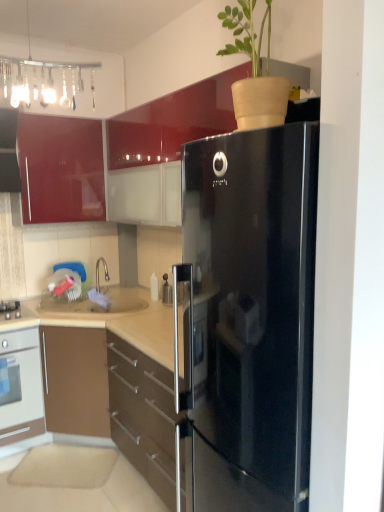
What do you see at coordinates (60, 169) in the screenshot? The height and width of the screenshot is (512, 384). I see `glossy red cabinet at upper left, which is counted as the first cabinetry, starting from the top` at bounding box center [60, 169].

The height and width of the screenshot is (512, 384). I want to click on brown glossy cabinet at lower left, arranged as the second cabinetry when viewed from the top, so click(97, 383).

Is glossy red cabinet at upper left, arranged as the second cabinetry when ordered from the bottom, inside or outside of white glossy oven at lower left?

glossy red cabinet at upper left, arranged as the second cabinetry when ordered from the bottom, cannot be found inside white glossy oven at lower left.

Which object is positioned more to the right, glossy red cabinet at upper left, arranged as the second cabinetry when ordered from the bottom, or white glossy oven at lower left?

glossy red cabinet at upper left, arranged as the second cabinetry when ordered from the bottom, is more to the right.

Is glossy red cabinet at upper left, arranged as the second cabinetry when ordered from the bottom, facing towards white glossy oven at lower left?

No, glossy red cabinet at upper left, arranged as the second cabinetry when ordered from the bottom, is not aimed at white glossy oven at lower left.

Which object is closer to the camera taking this photo, glossy red cabinet at upper left, arranged as the second cabinetry when ordered from the bottom, or white glossy oven at lower left?

white glossy oven at lower left.

Consider the image. In terms of width, does white glossy oven at lower left look wider or thinner when compared to glossy red cabinet at upper left, arranged as the second cabinetry when ordered from the bottom?

Considering their sizes, white glossy oven at lower left looks broader than glossy red cabinet at upper left, arranged as the second cabinetry when ordered from the bottom.

Where is `oven in front of the glossy red cabinet at upper left, arranged as the second cabinetry when ordered from the bottom`? The image size is (384, 512). oven in front of the glossy red cabinet at upper left, arranged as the second cabinetry when ordered from the bottom is located at coordinates (20, 386).

Considering the relative sizes of glossy red cabinet at upper left, arranged as the second cabinetry when ordered from the bottom, and brown glossy cabinet at lower left, the first cabinetry positioned from the bottom, in the image provided, is glossy red cabinet at upper left, arranged as the second cabinetry when ordered from the bottom, bigger than brown glossy cabinet at lower left, the first cabinetry positioned from the bottom,?

No, glossy red cabinet at upper left, arranged as the second cabinetry when ordered from the bottom, is not bigger than brown glossy cabinet at lower left, the first cabinetry positioned from the bottom.

Consider the image. Between glossy red cabinet at upper left, arranged as the second cabinetry when ordered from the bottom, and brown glossy cabinet at lower left, the first cabinetry positioned from the bottom, which one has larger width?

brown glossy cabinet at lower left, the first cabinetry positioned from the bottom.

Between glossy red cabinet at upper left, which is counted as the first cabinetry, starting from the top, and brown glossy cabinet at lower left, the first cabinetry positioned from the bottom, which one has less height?

glossy red cabinet at upper left, which is counted as the first cabinetry, starting from the top.

In the scene shown: Can brown glossy cabinet at lower left, the first cabinetry positioned from the bottom, be found inside glossy red cabinet at upper left, which is counted as the first cabinetry, starting from the top?

No, brown glossy cabinet at lower left, the first cabinetry positioned from the bottom, is not inside glossy red cabinet at upper left, which is counted as the first cabinetry, starting from the top.

From the image's perspective, who appears lower, white glossy oven at lower left or brown glossy cabinet at lower left, the first cabinetry positioned from the bottom?

brown glossy cabinet at lower left, the first cabinetry positioned from the bottom.

From a real-world perspective, relative to brown glossy cabinet at lower left, the first cabinetry positioned from the bottom, is white glossy oven at lower left vertically above or below?

In terms of real-world spatial position, white glossy oven at lower left is above brown glossy cabinet at lower left, the first cabinetry positioned from the bottom.

In the scene shown: Considering the relative positions of white glossy oven at lower left and brown glossy cabinet at lower left, the first cabinetry positioned from the bottom, in the image provided, is white glossy oven at lower left to the left of brown glossy cabinet at lower left, the first cabinetry positioned from the bottom, from the viewer's perspective?

Yes.

The height and width of the screenshot is (512, 384). In order to click on oven that appears above the brown glossy cabinet at lower left, arranged as the second cabinetry when viewed from the top (from a real-world perspective) in this screenshot , I will do `click(20, 386)`.

Which object is closer to the camera, brown glossy cabinet at lower left, the first cabinetry positioned from the bottom, or white glossy oven at lower left?

brown glossy cabinet at lower left, the first cabinetry positioned from the bottom.

From a real-world perspective, is brown glossy cabinet at lower left, arranged as the second cabinetry when viewed from the top, physically below white glossy oven at lower left?

Yes.

Is brown glossy cabinet at lower left, the first cabinetry positioned from the bottom, facing towards white glossy oven at lower left?

Yes, brown glossy cabinet at lower left, the first cabinetry positioned from the bottom, is turned towards white glossy oven at lower left.

Considering the positions of point (47, 481) and point (10, 337), is point (47, 481) closer or farther from the camera than point (10, 337)?

Clearly, point (47, 481) is closer to the camera than point (10, 337).

Is brown glossy cabinet at lower left, arranged as the second cabinetry when viewed from the top, oriented away from glossy red cabinet at upper left, arranged as the second cabinetry when ordered from the bottom?

No, brown glossy cabinet at lower left, arranged as the second cabinetry when viewed from the top, is not facing away from glossy red cabinet at upper left, arranged as the second cabinetry when ordered from the bottom.

Is brown glossy cabinet at lower left, the first cabinetry positioned from the bottom, wider than glossy red cabinet at upper left, which is counted as the first cabinetry, starting from the top?

Yes.

Is point (16, 417) behind point (101, 205)?

No.

From a real-world perspective, which is physically above, brown glossy cabinet at lower left, the first cabinetry positioned from the bottom, or glossy red cabinet at upper left, arranged as the second cabinetry when ordered from the bottom?

From a 3D spatial view, glossy red cabinet at upper left, arranged as the second cabinetry when ordered from the bottom, is above.

Where is `cabinetry behind the white glossy oven at lower left`? The image size is (384, 512). cabinetry behind the white glossy oven at lower left is located at coordinates (60, 169).

This screenshot has height=512, width=384. I want to click on the 1st cabinetry to the right of the white glossy oven at lower left, starting your count from the anchor, so click(x=60, y=169).

From the image, which object appears to be nearer to brown glossy cabinet at lower left, arranged as the second cabinetry when viewed from the top, glossy red cabinet at upper left, arranged as the second cabinetry when ordered from the bottom, or white glossy oven at lower left?

white glossy oven at lower left lies closer to brown glossy cabinet at lower left, arranged as the second cabinetry when viewed from the top, than the other object.

Considering their positions, is brown glossy cabinet at lower left, arranged as the second cabinetry when viewed from the top, positioned further to glossy red cabinet at upper left, arranged as the second cabinetry when ordered from the bottom, than white glossy oven at lower left?

Among the two, brown glossy cabinet at lower left, arranged as the second cabinetry when viewed from the top, is located further to glossy red cabinet at upper left, arranged as the second cabinetry when ordered from the bottom.

When comparing their distances from brown glossy cabinet at lower left, arranged as the second cabinetry when viewed from the top, does white glossy oven at lower left or glossy red cabinet at upper left, which is counted as the first cabinetry, starting from the top, seem further?

glossy red cabinet at upper left, which is counted as the first cabinetry, starting from the top, lies further to brown glossy cabinet at lower left, arranged as the second cabinetry when viewed from the top, than the other object.

From the image, which object appears to be farther from white glossy oven at lower left, brown glossy cabinet at lower left, the first cabinetry positioned from the bottom, or glossy red cabinet at upper left, arranged as the second cabinetry when ordered from the bottom?

glossy red cabinet at upper left, arranged as the second cabinetry when ordered from the bottom, lies further to white glossy oven at lower left than the other object.

Considering their positions, is white glossy oven at lower left positioned closer to glossy red cabinet at upper left, arranged as the second cabinetry when ordered from the bottom, than brown glossy cabinet at lower left, arranged as the second cabinetry when viewed from the top?

Based on the image, white glossy oven at lower left appears to be nearer to glossy red cabinet at upper left, arranged as the second cabinetry when ordered from the bottom.

Which object lies nearer to the anchor point white glossy oven at lower left, glossy red cabinet at upper left, arranged as the second cabinetry when ordered from the bottom, or brown glossy cabinet at lower left, the first cabinetry positioned from the bottom?

The object closer to white glossy oven at lower left is brown glossy cabinet at lower left, the first cabinetry positioned from the bottom.

Identify the location of oven between glossy red cabinet at upper left, arranged as the second cabinetry when ordered from the bottom, and brown glossy cabinet at lower left, arranged as the second cabinetry when viewed from the top, in the up-down direction. The image size is (384, 512). pyautogui.click(x=20, y=386).